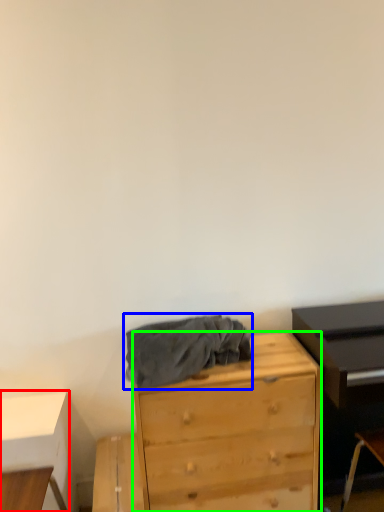
Question: Considering the real-world distances, which object is farthest from table (highlighted by a red box)? clothing (highlighted by a blue box) or chest of drawers (highlighted by a green box)?

Choices:
 (A) clothing
 (B) chest of drawers

Answer: (B)